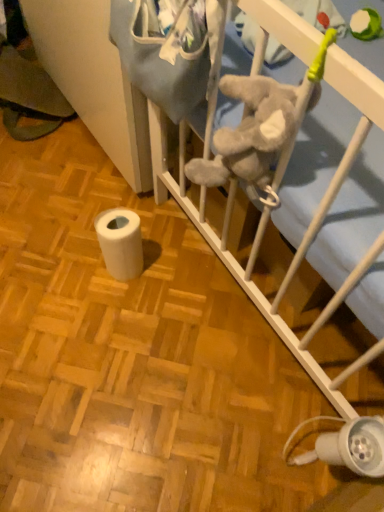
Locate an element on the screen. This screenshot has height=512, width=384. white soft infant bed at center is located at coordinates (270, 211).

What do you see at coordinates (120, 243) in the screenshot? The width and height of the screenshot is (384, 512). I see `white matte toilet paper at lower left` at bounding box center [120, 243].

Where is `white plastic lamp at lower right`? This screenshot has height=512, width=384. white plastic lamp at lower right is located at coordinates tap(351, 447).

Based on their positions, is white soft infant bed at center located to the left or right of white matte toilet paper at lower left?

Clearly, white soft infant bed at center is on the left of white matte toilet paper at lower left in the image.

Which of these two, white soft infant bed at center or white matte toilet paper at lower left, stands shorter?

Standing shorter between the two is white soft infant bed at center.

Identify the location of infant bed lying on the left of white matte toilet paper at lower left. (270, 211).

Would you say white matte toilet paper at lower left is part of white plastic lamp at lower right's contents?

That's incorrect, white matte toilet paper at lower left is not inside white plastic lamp at lower right.

Between white plastic lamp at lower right and white matte toilet paper at lower left, which one appears on the left side from the viewer's perspective?

white matte toilet paper at lower left is more to the left.

Which point is more forward, (379, 438) or (101, 241)?

The point (379, 438) is closer.

Could you tell me if white plastic lamp at lower right is facing white matte toilet paper at lower left?

No, white plastic lamp at lower right is not oriented towards white matte toilet paper at lower left.

Is white soft infant bed at center further to the viewer compared to white plastic lamp at lower right?

Yes, white soft infant bed at center is behind white plastic lamp at lower right.

Does white soft infant bed at center appear on the left side of white plastic lamp at lower right?

Yes, white soft infant bed at center is to the left of white plastic lamp at lower right.

Is white soft infant bed at center beside white plastic lamp at lower right?

No, white soft infant bed at center is not making contact with white plastic lamp at lower right.

Is point (338, 180) farther from camera compared to point (330, 446)?

That is False.

Is white plastic lamp at lower right positioned beyond the bounds of white soft infant bed at center?

Yes, white plastic lamp at lower right is not within white soft infant bed at center.

Could you tell me if white plastic lamp at lower right is facing white soft infant bed at center?

No, white plastic lamp at lower right does not turn towards white soft infant bed at center.

Does white plastic lamp at lower right have a smaller size compared to white soft infant bed at center?

Indeed, white plastic lamp at lower right has a smaller size compared to white soft infant bed at center.

How different are the orientations of white plastic lamp at lower right and white soft infant bed at center in degrees?

90 degrees.

From the picture: How many degrees apart are the facing directions of white matte toilet paper at lower left and white plastic lamp at lower right?

white matte toilet paper at lower left and white plastic lamp at lower right are facing 3.42 degrees away from each other.

Which of these two, white matte toilet paper at lower left or white plastic lamp at lower right, is bigger?

With larger size is white plastic lamp at lower right.

Image resolution: width=384 pixels, height=512 pixels. Identify the location of toilet paper below the white plastic lamp at lower right (from a real-world perspective). (120, 243).

From a real-world perspective, who is located lower, white matte toilet paper at lower left or white plastic lamp at lower right?

From a 3D spatial view, white matte toilet paper at lower left is below.

The image size is (384, 512). Find the location of `infant bed directly beneath the white matte toilet paper at lower left (from a real-world perspective)`. infant bed directly beneath the white matte toilet paper at lower left (from a real-world perspective) is located at coordinates (270, 211).

Is white matte toilet paper at lower left situated inside white soft infant bed at center or outside?

white matte toilet paper at lower left exists outside the volume of white soft infant bed at center.

Is white matte toilet paper at lower left positioned far away from white soft infant bed at center?

Actually, white matte toilet paper at lower left and white soft infant bed at center are a little close together.

Image resolution: width=384 pixels, height=512 pixels. I want to click on infant bed in front of the white matte toilet paper at lower left, so click(270, 211).

At what (x,y) coordinates should I click in order to perform the action: click on toilet paper below the white plastic lamp at lower right (from a real-world perspective). Please return your answer as a coordinate pair (x, y). Image resolution: width=384 pixels, height=512 pixels. Looking at the image, I should click on (120, 243).

From the image, which object appears to be farther from white soft infant bed at center, white matte toilet paper at lower left or white plastic lamp at lower right?

Based on the image, white plastic lamp at lower right appears to be further to white soft infant bed at center.

Based on their spatial positions, is white matte toilet paper at lower left or white soft infant bed at center closer to white plastic lamp at lower right?

white soft infant bed at center.

Which object lies further to the anchor point white plastic lamp at lower right, white soft infant bed at center or white matte toilet paper at lower left?

white matte toilet paper at lower left is positioned further to the anchor white plastic lamp at lower right.

Considering their positions, is white plastic lamp at lower right positioned closer to white soft infant bed at center than white matte toilet paper at lower left?

Among the two, white matte toilet paper at lower left is located nearer to white soft infant bed at center.

When comparing their distances from white matte toilet paper at lower left, does white plastic lamp at lower right or white soft infant bed at center seem closer?

The object closer to white matte toilet paper at lower left is white soft infant bed at center.

Estimate the real-world distances between objects in this image. Which object is closer to white matte toilet paper at lower left, white soft infant bed at center or white plastic lamp at lower right?

white soft infant bed at center is closer to white matte toilet paper at lower left.

Where is `toilet paper between white soft infant bed at center and white plastic lamp at lower right in the horizontal direction`? Image resolution: width=384 pixels, height=512 pixels. toilet paper between white soft infant bed at center and white plastic lamp at lower right in the horizontal direction is located at coordinates (120, 243).